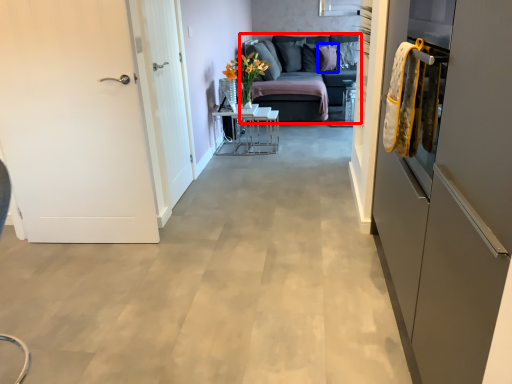
Question: Which object is closer to the camera taking this photo, studio couch (highlighted by a red box) or pillow (highlighted by a blue box)?

Choices:
 (A) studio couch
 (B) pillow

Answer: (A)